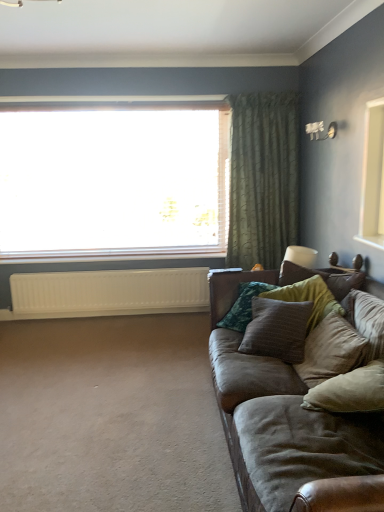
This screenshot has width=384, height=512. Find the location of `green textured curtain at upper right`. green textured curtain at upper right is located at coordinates (263, 178).

I want to click on textured brown pillow at right, arranged as the 1th pillow when viewed from the back, so click(308, 298).

The image size is (384, 512). What do you see at coordinates (308, 298) in the screenshot? I see `textured brown pillow at right, which is counted as the 3th pillow, starting from the front` at bounding box center [308, 298].

Where is `white plastic light fixture at upper right`? This screenshot has width=384, height=512. white plastic light fixture at upper right is located at coordinates (321, 130).

What do you see at coordinates (107, 293) in the screenshot? The height and width of the screenshot is (512, 384). I see `white matte radiator at lower left` at bounding box center [107, 293].

This screenshot has height=512, width=384. In order to click on beige fabric pillow at lower right, which ranks as the third pillow in back-to-front order in this screenshot , I will do `click(350, 391)`.

Locate an element on the screen. The height and width of the screenshot is (512, 384). transparent glass window at upper center is located at coordinates (113, 182).

What do you see at coordinates (286, 421) in the screenshot? The image size is (384, 512). I see `brown suede couch at right` at bounding box center [286, 421].

Find the location of `green textured curtain at upper right`. green textured curtain at upper right is located at coordinates (263, 178).

From the image's perspective, is velvet beige pillow at right, the 2th pillow when ordered from back to front, positioned above or below white matte radiator at lower left?

Based on their image positions, velvet beige pillow at right, the 2th pillow when ordered from back to front, is located beneath white matte radiator at lower left.

Which object is thinner, velvet beige pillow at right, the 2th pillow when ordered from back to front, or white matte radiator at lower left?

With smaller width is white matte radiator at lower left.

Is velvet beige pillow at right, arranged as the second pillow when viewed from the front, directly adjacent to white matte radiator at lower left?

velvet beige pillow at right, arranged as the second pillow when viewed from the front, is not next to white matte radiator at lower left, and they're not touching.

From a real-world perspective, who is located higher, velvet beige pillow at right, the 2th pillow when ordered from back to front, or white matte radiator at lower left?

From a 3D spatial view, velvet beige pillow at right, the 2th pillow when ordered from back to front, is above.

How much distance is there between textured brown pillow at right, arranged as the 1th pillow when viewed from the back, and white matte radiator at lower left?

The distance of textured brown pillow at right, arranged as the 1th pillow when viewed from the back, from white matte radiator at lower left is 1.93 meters.

Is textured brown pillow at right, which is counted as the 3th pillow, starting from the front, oriented away from white matte radiator at lower left?

No.

Can you tell me how much textured brown pillow at right, arranged as the 1th pillow when viewed from the back, and white matte radiator at lower left differ in facing direction?

There is a 84.3-degree angle between the facing directions of textured brown pillow at right, arranged as the 1th pillow when viewed from the back, and white matte radiator at lower left.

Would you say textured brown pillow at right, arranged as the 1th pillow when viewed from the back, is inside or outside white matte radiator at lower left?

textured brown pillow at right, arranged as the 1th pillow when viewed from the back, exists outside the volume of white matte radiator at lower left.

This screenshot has height=512, width=384. Identify the location of window above the brown suede couch at right (from the image's perspective). (113, 182).

What's the angular difference between transparent glass window at upper center and brown suede couch at right's facing directions?

transparent glass window at upper center and brown suede couch at right are facing 90.3 degrees away from each other.

In terms of height, does transparent glass window at upper center look taller or shorter compared to brown suede couch at right?

transparent glass window at upper center is taller than brown suede couch at right.

Is transparent glass window at upper center closer to the viewer compared to brown suede couch at right?

No.

Could you tell me if white matte radiator at lower left is turned towards transparent glass window at upper center?

No, white matte radiator at lower left does not turn towards transparent glass window at upper center.

Which object is further away from the camera taking this photo, white matte radiator at lower left or transparent glass window at upper center?

Positioned behind is white matte radiator at lower left.

Considering the positions of objects white matte radiator at lower left and transparent glass window at upper center in the image provided, who is more to the left, white matte radiator at lower left or transparent glass window at upper center?

Positioned to the left is white matte radiator at lower left.

Is transparent glass window at upper center inside white matte radiator at lower left?

No, transparent glass window at upper center is not inside white matte radiator at lower left.

Considering the sizes of objects transparent glass window at upper center and white matte radiator at lower left in the image provided, who is thinner, transparent glass window at upper center or white matte radiator at lower left?

white matte radiator at lower left is thinner.

Considering the sizes of transparent glass window at upper center and white matte radiator at lower left in the image, is transparent glass window at upper center bigger or smaller than white matte radiator at lower left?

transparent glass window at upper center is bigger than white matte radiator at lower left.

Between transparent glass window at upper center and white matte radiator at lower left, which one appears on the left side from the viewer's perspective?

From the viewer's perspective, white matte radiator at lower left appears more on the left side.

From a real-world perspective, between transparent glass window at upper center and white matte radiator at lower left, who is vertically lower?

white matte radiator at lower left is physically lower.

From a real-world perspective, is brown suede couch at right above or below textured brown pillow at right, arranged as the 1th pillow when viewed from the back?

In terms of real-world spatial position, brown suede couch at right is below textured brown pillow at right, arranged as the 1th pillow when viewed from the back.

Considering the sizes of brown suede couch at right and textured brown pillow at right, arranged as the 1th pillow when viewed from the back, in the image, is brown suede couch at right taller or shorter than textured brown pillow at right, arranged as the 1th pillow when viewed from the back,?

Clearly, brown suede couch at right is taller compared to textured brown pillow at right, arranged as the 1th pillow when viewed from the back.

Looking at this image, considering the relative sizes of brown suede couch at right and textured brown pillow at right, arranged as the 1th pillow when viewed from the back, in the image provided, is brown suede couch at right smaller than textured brown pillow at right, arranged as the 1th pillow when viewed from the back,?

No.

Does brown suede couch at right have a lesser width compared to textured brown pillow at right, which is counted as the 3th pillow, starting from the front?

No, brown suede couch at right is not thinner than textured brown pillow at right, which is counted as the 3th pillow, starting from the front.

Considering the sizes of objects textured brown pillow at right, arranged as the 1th pillow when viewed from the back, and velvet beige pillow at right, arranged as the second pillow when viewed from the front, in the image provided, who is taller, textured brown pillow at right, arranged as the 1th pillow when viewed from the back, or velvet beige pillow at right, arranged as the second pillow when viewed from the front,?

velvet beige pillow at right, arranged as the second pillow when viewed from the front, is taller.

Is velvet beige pillow at right, the 2th pillow when ordered from back to front, located within textured brown pillow at right, which is counted as the 3th pillow, starting from the front?

No, velvet beige pillow at right, the 2th pillow when ordered from back to front, is not surrounded by textured brown pillow at right, which is counted as the 3th pillow, starting from the front.

From the image's perspective, between textured brown pillow at right, which is counted as the 3th pillow, starting from the front, and velvet beige pillow at right, arranged as the second pillow when viewed from the front, which one is located above?

From the image's view, textured brown pillow at right, which is counted as the 3th pillow, starting from the front, is above.

Is textured brown pillow at right, which is counted as the 3th pillow, starting from the front, wider or thinner than velvet beige pillow at right, arranged as the second pillow when viewed from the front?

Clearly, textured brown pillow at right, which is counted as the 3th pillow, starting from the front, has more width compared to velvet beige pillow at right, arranged as the second pillow when viewed from the front.

At what (x,y) coordinates should I click in order to perform the action: click on the 2nd pillow directly above the white matte radiator at lower left (from a real-world perspective). Please return your answer as a coordinate pair (x, y). Looking at the image, I should click on (331, 350).

Find the location of a particular element. Image resolution: width=384 pixels, height=512 pixels. pillow that is the 1st object located in front of the white matte radiator at lower left is located at coordinates (308, 298).

When comparing their distances from green textured curtain at upper right, does beige fabric pillow at lower right, the 1th pillow in the front-to-back sequence, or transparent glass window at upper center seem closer?

transparent glass window at upper center is positioned closer to the anchor green textured curtain at upper right.

Estimate the real-world distances between objects in this image. Which object is closer to green textured curtain at upper right, white matte radiator at lower left or white plastic light fixture at upper right?

Among the two, white plastic light fixture at upper right is located nearer to green textured curtain at upper right.

When comparing their distances from white plastic light fixture at upper right, does beige fabric pillow at lower right, the 1th pillow in the front-to-back sequence, or brown suede couch at right seem further?

beige fabric pillow at lower right, the 1th pillow in the front-to-back sequence, is further to white plastic light fixture at upper right.

Considering their positions, is white plastic light fixture at upper right positioned closer to beige fabric pillow at lower right, the 1th pillow in the front-to-back sequence, than white matte radiator at lower left?

white plastic light fixture at upper right is positioned closer to the anchor beige fabric pillow at lower right, the 1th pillow in the front-to-back sequence.

Considering their positions, is white plastic light fixture at upper right positioned further to beige fabric pillow at lower right, which ranks as the third pillow in back-to-front order, than velvet beige pillow at right, the 2th pillow when ordered from back to front?

white plastic light fixture at upper right is further to beige fabric pillow at lower right, which ranks as the third pillow in back-to-front order.

Based on their spatial positions, is velvet beige pillow at right, the 2th pillow when ordered from back to front, or textured brown pillow at right, arranged as the 1th pillow when viewed from the back, closer to brown suede couch at right?

Based on the image, velvet beige pillow at right, the 2th pillow when ordered from back to front, appears to be nearer to brown suede couch at right.

Which object lies further to the anchor point beige fabric pillow at lower right, the 1th pillow in the front-to-back sequence, transparent glass window at upper center or white matte radiator at lower left?

transparent glass window at upper center.

Looking at the image, which one is located closer to beige fabric pillow at lower right, the 1th pillow in the front-to-back sequence, white matte radiator at lower left or white plastic light fixture at upper right?

white plastic light fixture at upper right is closer to beige fabric pillow at lower right, the 1th pillow in the front-to-back sequence.

Image resolution: width=384 pixels, height=512 pixels. I want to click on pillow between white plastic light fixture at upper right and velvet beige pillow at right, the 2th pillow when ordered from back to front, from top to bottom, so click(x=308, y=298).

Locate an element on the screen. This screenshot has width=384, height=512. window positioned between velvet beige pillow at right, the 2th pillow when ordered from back to front, and white matte radiator at lower left from near to far is located at coordinates (113, 182).

This screenshot has width=384, height=512. Identify the location of light fixture between brown suede couch at right and green textured curtain at upper right in the front-back direction. (321, 130).

In order to click on curtain between velvet beige pillow at right, arranged as the second pillow when viewed from the front, and white matte radiator at lower left, along the z-axis in this screenshot , I will do `click(263, 178)`.